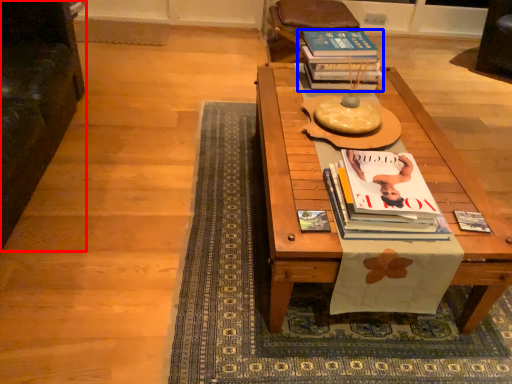
Question: Among these objects, which one is nearest to the camera, armchair (highlighted by a red box) or book (highlighted by a blue box)?

Choices:
 (A) armchair
 (B) book

Answer: (A)